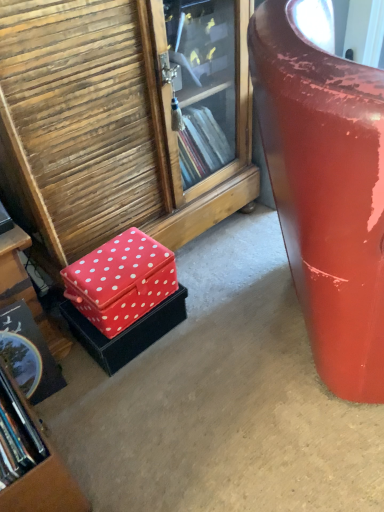
Describe the element at coordinates (30, 461) in the screenshot. Image resolution: width=384 pixels, height=512 pixels. I see `wooden bookcase at lower left` at that location.

Locate an element on the screen. The image size is (384, 512). red fabric box at lower left is located at coordinates (221, 399).

You are a GUI agent. You are given a task and a screenshot of the screen. Output one action in this format:
    pyautogui.click(x=<x>, y=<y>)
    Task: Click on the wooden bookcase at lower left
    This screenshot has width=384, height=512.
    Given the screenshot: What is the action you would take?
    pyautogui.click(x=30, y=461)

Who is shorter, red fabric box at lower left, the 2th box in the bottom-to-top sequence, or glossy red suitcase at right?

red fabric box at lower left, the 2th box in the bottom-to-top sequence.

From the image's perspective, is red fabric box at lower left, the 2th box in the bottom-to-top sequence, positioned above or below glossy red suitcase at right?

red fabric box at lower left, the 2th box in the bottom-to-top sequence, is below glossy red suitcase at right.

From a real-world perspective, is red fabric box at lower left, placed as the first box when sorted from top to bottom, above or below glossy red suitcase at right?

In terms of real-world spatial position, red fabric box at lower left, placed as the first box when sorted from top to bottom, is below glossy red suitcase at right.

Is point (89, 257) more distant than point (327, 199)?

Yes, point (89, 257) is farther from viewer.

Which object is thinner, red fabric box at lower left or red fabric box at lower left, the 2th box in the bottom-to-top sequence?

With smaller width is red fabric box at lower left, the 2th box in the bottom-to-top sequence.

Between red fabric box at lower left and red fabric box at lower left, the 2th box in the bottom-to-top sequence, which one has more height?

red fabric box at lower left, the 2th box in the bottom-to-top sequence.

From the image's perspective, does red fabric box at lower left appear lower than red fabric box at lower left, the 2th box in the bottom-to-top sequence?

Yes, from the image's perspective, red fabric box at lower left is below red fabric box at lower left, the 2th box in the bottom-to-top sequence.

Is red fabric box at lower left next to red fabric box at lower left, placed as the first box when sorted from top to bottom, and touching it?

red fabric box at lower left is not next to red fabric box at lower left, placed as the first box when sorted from top to bottom, and they're not touching.

Considering the relative sizes of red fabric box at lower left and glossy red suitcase at right in the image provided, is red fabric box at lower left thinner than glossy red suitcase at right?

No, red fabric box at lower left is not thinner than glossy red suitcase at right.

Between red fabric box at lower left and glossy red suitcase at right, which one has more height?

Standing taller between the two is glossy red suitcase at right.

The width and height of the screenshot is (384, 512). I want to click on furniture that appears above the red fabric box at lower left (from a real-world perspective), so click(x=326, y=185).

Choose the correct answer: Is red fabric box at lower left inside glossy red suitcase at right or outside it?

red fabric box at lower left is located beyond the bounds of glossy red suitcase at right.

Which object is further away from the camera, red fabric box at lower left, the 2th box positioned from the top, or wooden bookcase at lower left?

red fabric box at lower left, the 2th box positioned from the top, is more distant.

At what (x,y) coordinates should I click in order to perform the action: click on bookcase that appears above the red fabric box at lower left, which ranks as the first box in bottom-to-top order (from a real-world perspective). Please return your answer as a coordinate pair (x, y). Looking at the image, I should click on (30, 461).

Could wooden bookcase at lower left be considered to be inside red fabric box at lower left, which ranks as the first box in bottom-to-top order?

Actually, wooden bookcase at lower left is outside red fabric box at lower left, which ranks as the first box in bottom-to-top order.

Is red fabric box at lower left situated inside wooden bookcase at lower left or outside?

red fabric box at lower left cannot be found inside wooden bookcase at lower left.

From a real-world perspective, is red fabric box at lower left physically above wooden bookcase at lower left?

Incorrect, from a real-world perspective, red fabric box at lower left is lower than wooden bookcase at lower left.

Considering the relative sizes of red fabric box at lower left and wooden bookcase at lower left in the image provided, is red fabric box at lower left taller than wooden bookcase at lower left?

Incorrect, the height of red fabric box at lower left is not larger of that of wooden bookcase at lower left.

Considering the sizes of objects red fabric box at lower left, which ranks as the first box in bottom-to-top order, and glossy red suitcase at right in the image provided, who is bigger, red fabric box at lower left, which ranks as the first box in bottom-to-top order, or glossy red suitcase at right?

glossy red suitcase at right.

Is red fabric box at lower left, the 2th box positioned from the top, inside or outside of glossy red suitcase at right?

red fabric box at lower left, the 2th box positioned from the top, is not inside glossy red suitcase at right, it's outside.

Considering the points (74, 332) and (296, 79), which point is behind, point (74, 332) or point (296, 79)?

Positioned behind is point (74, 332).

Could you tell me if red fabric box at lower left, the 2th box positioned from the top, is turned towards glossy red suitcase at right?

No, red fabric box at lower left, the 2th box positioned from the top, is not facing towards glossy red suitcase at right.

From the image's perspective, which is below, glossy red suitcase at right or red fabric box at lower left?

red fabric box at lower left, from the image's perspective.

Is glossy red suitcase at right at the right side of red fabric box at lower left?

Yes, glossy red suitcase at right is to the right of red fabric box at lower left.

Is point (349, 386) positioned before point (136, 369)?

Yes, point (349, 386) is in front of point (136, 369).

Is glossy red suitcase at right not inside red fabric box at lower left?

Absolutely, glossy red suitcase at right is external to red fabric box at lower left.

From a real-world perspective, starting from the glossy red suitcase at right, which box is the 1st one below it? Please provide its 2D coordinates.

[(121, 281)]

Which box is the 2nd one when counting from the left side of the red fabric box at lower left? Please provide its 2D coordinates.

[(121, 281)]

From the image, which object appears to be nearer to wooden bookcase at lower left, glossy red suitcase at right or red fabric box at lower left, the 2th box positioned from the top?

red fabric box at lower left, the 2th box positioned from the top, lies closer to wooden bookcase at lower left than the other object.

From the image, which object appears to be nearer to glossy red suitcase at right, red fabric box at lower left, the 2th box positioned from the top, or wooden bookcase at lower left?

Based on the image, red fabric box at lower left, the 2th box positioned from the top, appears to be nearer to glossy red suitcase at right.

Which object lies nearer to the anchor point glossy red suitcase at right, red fabric box at lower left or red fabric box at lower left, the 2th box positioned from the top?

Among the two, red fabric box at lower left is located nearer to glossy red suitcase at right.

From the image, which object appears to be farther from red fabric box at lower left, placed as the first box when sorted from top to bottom, glossy red suitcase at right or wooden bookcase at lower left?

The object further to red fabric box at lower left, placed as the first box when sorted from top to bottom, is glossy red suitcase at right.

Considering their positions, is red fabric box at lower left, which ranks as the first box in bottom-to-top order, positioned further to red fabric box at lower left, the 2th box in the bottom-to-top sequence, than wooden bookcase at lower left?

The object further to red fabric box at lower left, the 2th box in the bottom-to-top sequence, is wooden bookcase at lower left.

Looking at the image, which one is located closer to glossy red suitcase at right, red fabric box at lower left, the 2th box positioned from the top, or red fabric box at lower left, placed as the first box when sorted from top to bottom?

Among the two, red fabric box at lower left, placed as the first box when sorted from top to bottom, is located nearer to glossy red suitcase at right.

Estimate the real-world distances between objects in this image. Which object is closer to glossy red suitcase at right, red fabric box at lower left or wooden bookcase at lower left?

Based on the image, red fabric box at lower left appears to be nearer to glossy red suitcase at right.

From the image, which object appears to be farther from red fabric box at lower left, the 2th box in the bottom-to-top sequence, wooden bookcase at lower left or red fabric box at lower left, which ranks as the first box in bottom-to-top order?

Among the two, wooden bookcase at lower left is located further to red fabric box at lower left, the 2th box in the bottom-to-top sequence.

Find the location of a particular element. box between wooden bookcase at lower left and red fabric box at lower left, the 2th box positioned from the top, from front to back is located at coordinates click(121, 281).

Locate an element on the screen. The height and width of the screenshot is (512, 384). box between red fabric box at lower left and red fabric box at lower left, which ranks as the first box in bottom-to-top order, in the front-back direction is located at coordinates (121, 281).

At what (x,y) coordinates should I click in order to perform the action: click on concrete between glossy red suitcase at right and red fabric box at lower left, which ranks as the first box in bottom-to-top order, in the front-back direction. Please return your answer as a coordinate pair (x, y). This screenshot has height=512, width=384. Looking at the image, I should click on (221, 399).

This screenshot has height=512, width=384. Find the location of `concrete located between wooden bookcase at lower left and glossy red suitcase at right in the left-right direction`. concrete located between wooden bookcase at lower left and glossy red suitcase at right in the left-right direction is located at coordinates (221, 399).